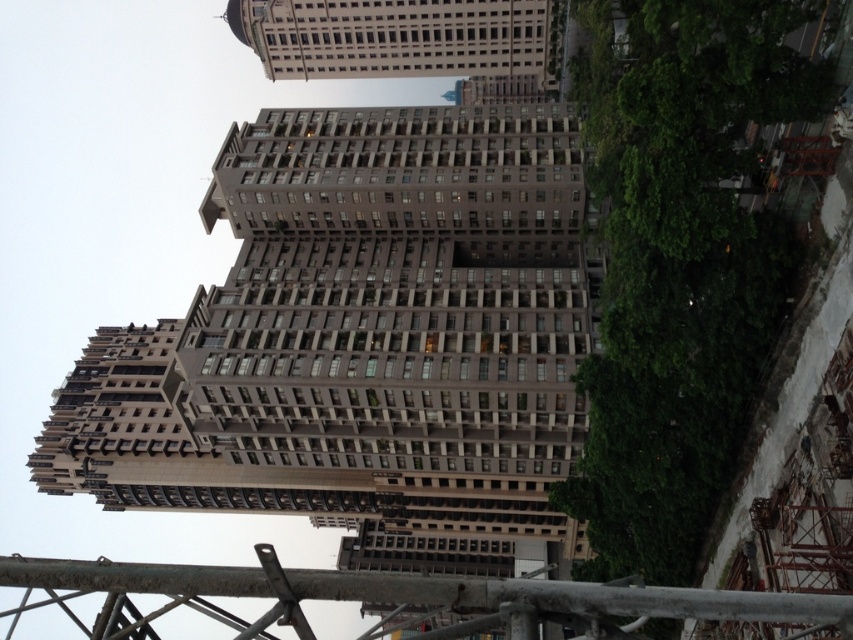
You are a window cleaner who needs to reach the top of the beige stone building at upper center. The metallic scaffolding at center is in your way. Can you climb over the scaffolding to reach the top of the building?

The metallic scaffolding at center is taller than beige stone building at upper center, so you cannot climb over the scaffolding to reach the top of the building because the scaffolding is already taller than the building itself.

You are a construction worker who needs to access the beige stone building at upper center. You see the metallic scaffolding at center. Which structure is positioned lower in the image?

The metallic scaffolding at center is positioned lower than the beige stone building at upper center.